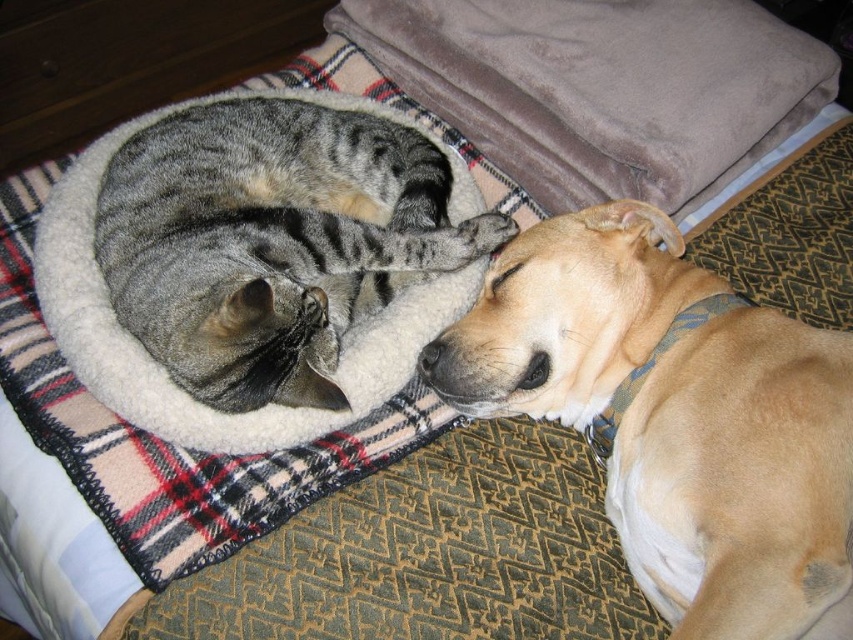
Which is above, light brown fur at lower right or gray striped cat at left?

gray striped cat at left is above.

Is light brown fur at lower right closer to the viewer compared to gray striped cat at left?

That is True.

Is point (659, 461) behind point (238, 104)?

No.

At what (x,y) coordinates should I click in order to perform the action: click on light brown fur at lower right. Please return your answer as a coordinate pair (x, y). This screenshot has width=853, height=640. Looking at the image, I should click on (x=741, y=481).